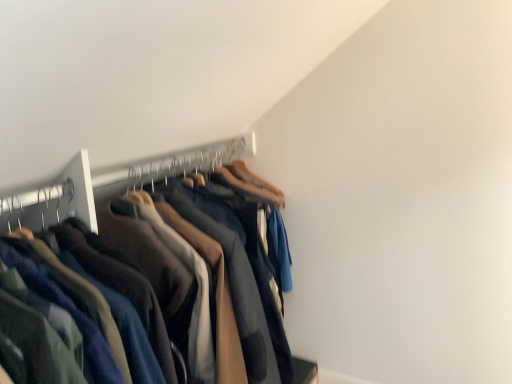
Question: Should I look upward or downward to see dark blue cotton pants at center?

Choices:
 (A) down
 (B) up

Answer: (A)

Question: Is wooden hanger at upper center with dark blue cotton pants at center?

Choices:
 (A) no
 (B) yes

Answer: (A)

Question: Could you tell me if wooden hanger at upper center is facing dark blue cotton pants at center?

Choices:
 (A) no
 (B) yes

Answer: (A)

Question: Is wooden hanger at upper center outside of dark blue cotton pants at center?

Choices:
 (A) no
 (B) yes

Answer: (B)

Question: Considering the relative positions of wooden hanger at upper center and dark blue cotton pants at center in the image provided, is wooden hanger at upper center to the left of dark blue cotton pants at center from the viewer's perspective?

Choices:
 (A) yes
 (B) no

Answer: (B)

Question: Is wooden hanger at upper center taller than dark blue cotton pants at center?

Choices:
 (A) yes
 (B) no

Answer: (B)

Question: Is wooden hanger at upper center smaller than dark blue cotton pants at center?

Choices:
 (A) yes
 (B) no

Answer: (A)

Question: From the image's perspective, is dark blue cotton pants at center over wooden hanger at upper center?

Choices:
 (A) no
 (B) yes

Answer: (A)

Question: Can you confirm if dark blue cotton pants at center is bigger than wooden hanger at upper center?

Choices:
 (A) yes
 (B) no

Answer: (A)

Question: Can you confirm if dark blue cotton pants at center is positioned to the left of wooden hanger at upper center?

Choices:
 (A) yes
 (B) no

Answer: (A)

Question: Is wooden hanger at upper center at the back of dark blue cotton pants at center?

Choices:
 (A) yes
 (B) no

Answer: (B)

Question: Are dark blue cotton pants at center and wooden hanger at upper center far apart?

Choices:
 (A) no
 (B) yes

Answer: (A)

Question: Is the depth of dark blue cotton pants at center greater than that of wooden hanger at upper center?

Choices:
 (A) yes
 (B) no

Answer: (B)

Question: From the image's perspective, relative to dark blue cotton pants at center, is wooden hanger at upper center above or below?

Choices:
 (A) above
 (B) below

Answer: (A)